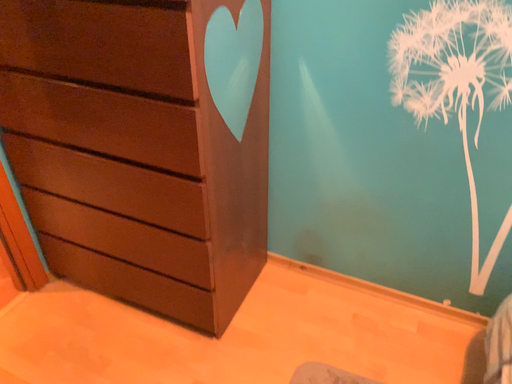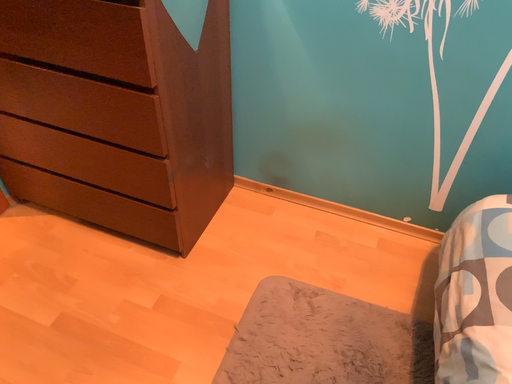
Question: Which way did the camera rotate in the video?

Choices:
 (A) rotated downward
 (B) rotated upward

Answer: (A)